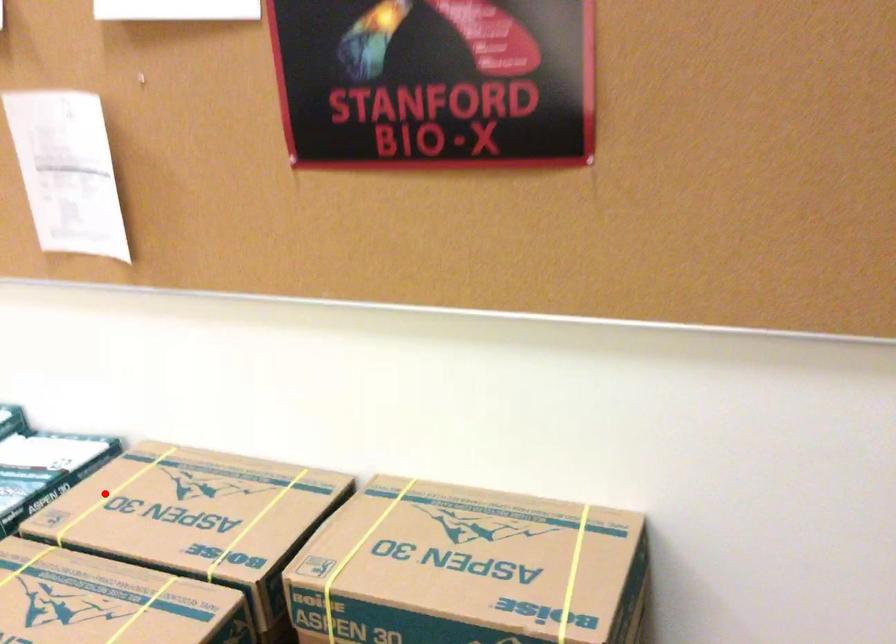
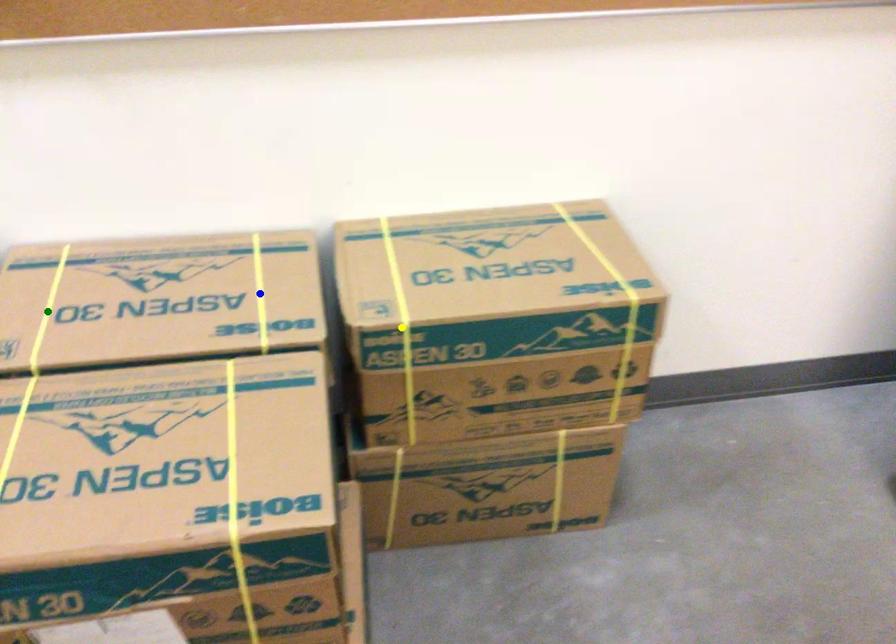
Question: I am providing you with two images of the same scene from different viewpoints. A red point is marked on the first image. You are given multiple points on the second image. Which point in image 2 is actually the same real-world point as the red point in image 1?

Choices:
 (A) yellow point
 (B) blue point
 (C) green point

Answer: (C)